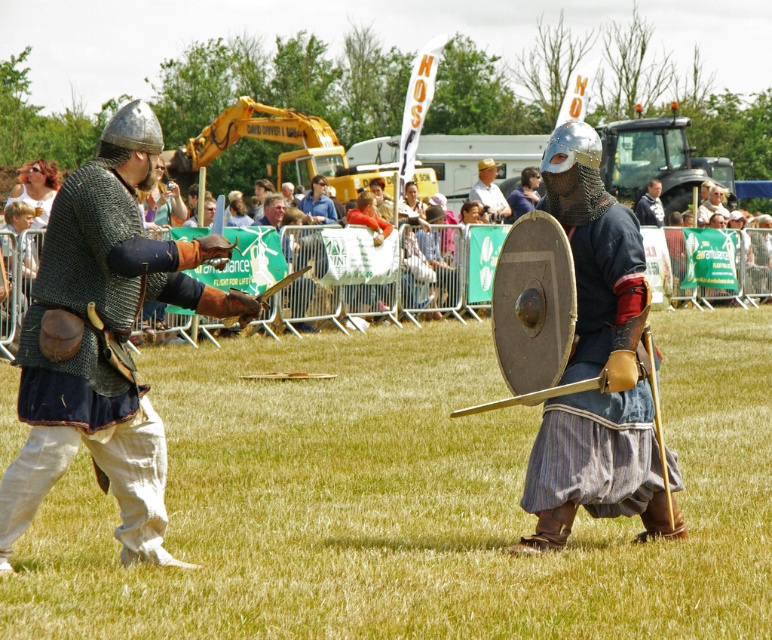
Question: Is matte black sword at center positioned in front of matte silver shield at center?

Choices:
 (A) yes
 (B) no

Answer: (A)

Question: Among these objects, which one is nearest to the camera?

Choices:
 (A) matte black sword at center
 (B) light brown leather hat at upper center
 (C) matte silver shield at center

Answer: (A)

Question: Which point is closer to the camera?

Choices:
 (A) (654, 515)
 (B) (168, 484)
 (C) (493, 189)

Answer: (A)

Question: Is matte black sword at center above light brown leather hat at upper center?

Choices:
 (A) no
 (B) yes

Answer: (A)

Question: Which of the following is the closest to the observer?

Choices:
 (A) light brown leather hat at upper center
 (B) matte black sword at center

Answer: (B)

Question: Does matte black sword at center have a smaller size compared to light brown leather hat at upper center?

Choices:
 (A) yes
 (B) no

Answer: (B)